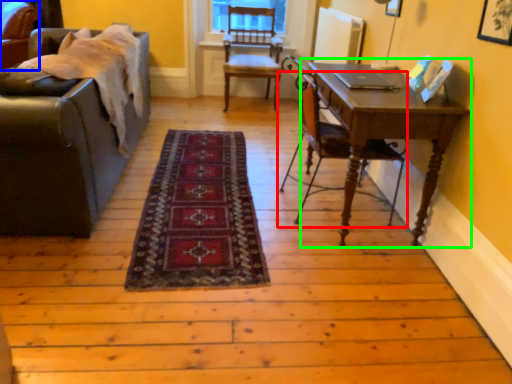
Question: Considering the real-world distances, which object is farthest from chair (highlighted by a red box)? chair (highlighted by a blue box) or table (highlighted by a green box)?

Choices:
 (A) chair
 (B) table

Answer: (A)